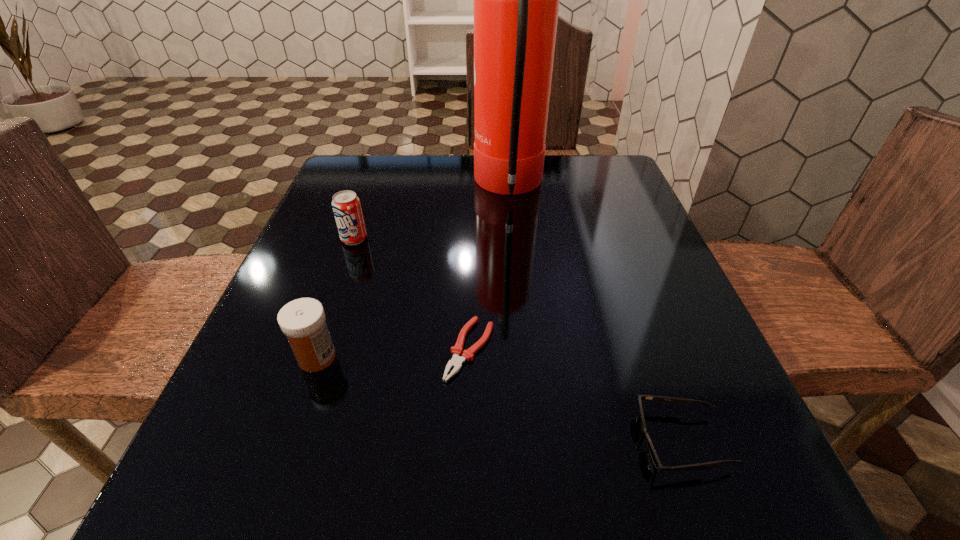
Locate an element on the screen. object that is at the right edge is located at coordinates (678, 401).

The height and width of the screenshot is (540, 960). Find the location of `object that is at the near right corner`. object that is at the near right corner is located at coordinates (678, 401).

Where is `vacant space at the far edge of the desktop`? vacant space at the far edge of the desktop is located at coordinates (466, 166).

Find the location of a particular element. free space at the near edge is located at coordinates (444, 526).

Locate an element on the screen. Image resolution: width=960 pixels, height=540 pixels. vacant region at the left edge of the desktop is located at coordinates (317, 207).

Where is `vacant space at the right edge`? Image resolution: width=960 pixels, height=540 pixels. vacant space at the right edge is located at coordinates [637, 338].

In the image, there is a desktop. At what (x,y) coordinates should I click in order to perform the action: click on vacant space at the far left corner. Please return your answer as a coordinate pair (x, y). This screenshot has width=960, height=540. Looking at the image, I should click on (337, 181).

Locate an element on the screen. vacant space at the near left corner of the desktop is located at coordinates (291, 517).

Image resolution: width=960 pixels, height=540 pixels. Identify the location of vacant point at the far right corner. (611, 163).

I want to click on empty location between the soda can and the shortest object, so click(412, 294).